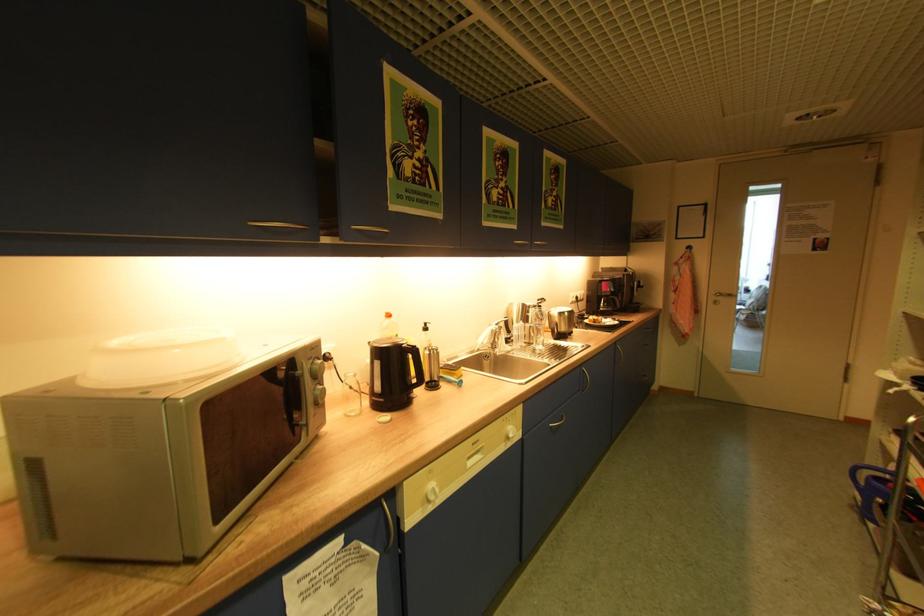
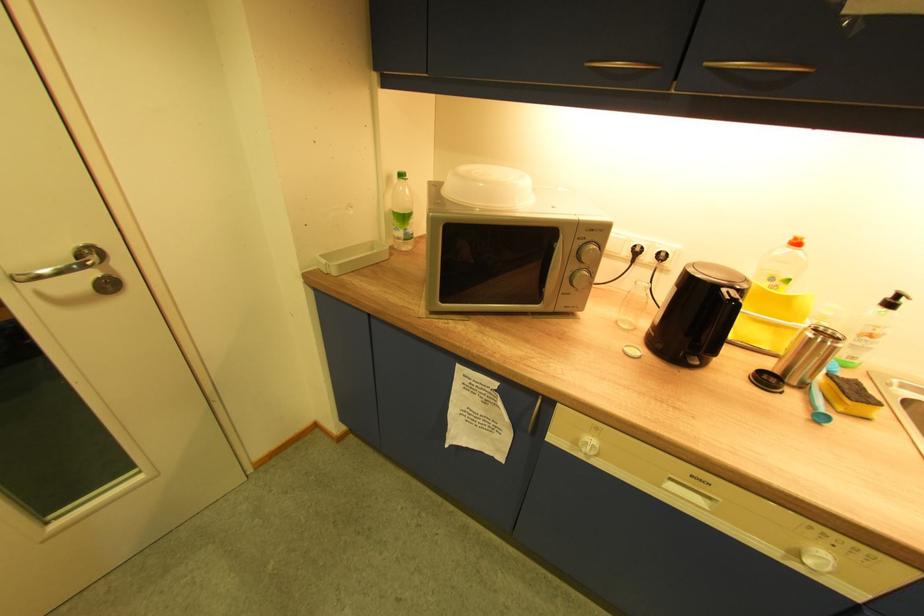
Find the pixel in the second image that matches [440,354] in the first image.

(830, 342)